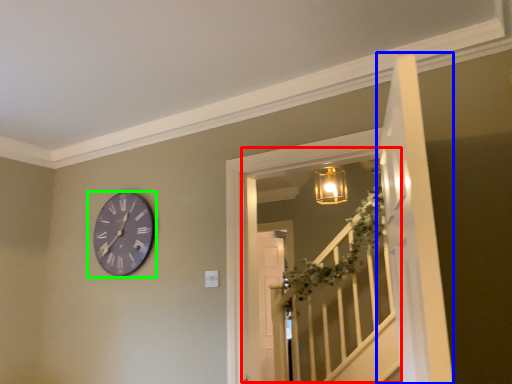
Question: Considering the real-world distances, which object is farthest from window (highlighted by a red box)? door (highlighted by a blue box) or wall clock (highlighted by a green box)?

Choices:
 (A) door
 (B) wall clock

Answer: (A)